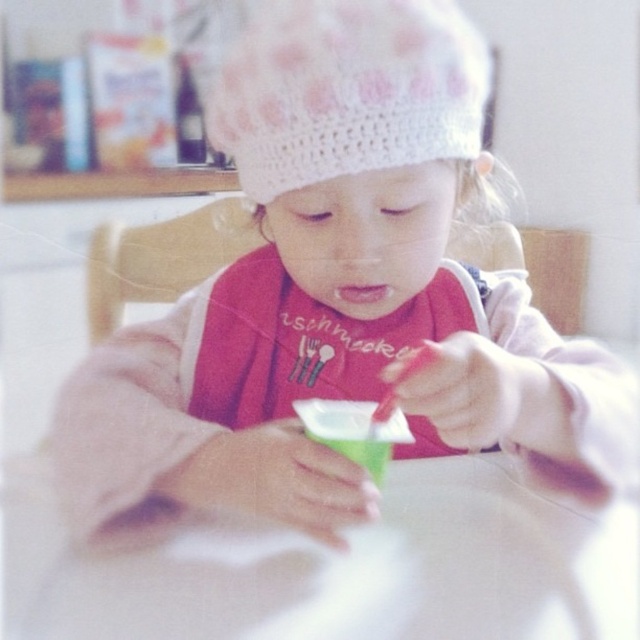
You are a photographer trying to capture a closeup of the child in the image. You notice two points of interest marked at coordinates point (422,474) and point (362,449). Which point should you focus on to ensure the child is in sharp focus?

You should focus on point (422,474) because it is closer to the camera, ensuring the child will be in sharp focus.

You are a parent trying to place a small toy on the table. The white glossy table at center and the green plastic cup at center are in your way. Which object should you move to make space?

You should move the green plastic cup at center because the white glossy table at center is closer to you, so the cup is further away and can be moved out of the way.

You are a photographer trying to capture a closeup of the child in the image. You have a camera with a fixed focus that can only focus on one point at a time. The two points you can choose from are point (470, 632) and point (419, 77). Which point should you select to ensure the child is in focus?

Point (470, 632) is closer to the camera than point (419, 77). Therefore, to ensure the child is in focus, you should select point (470, 632) as it is nearer to the camera.